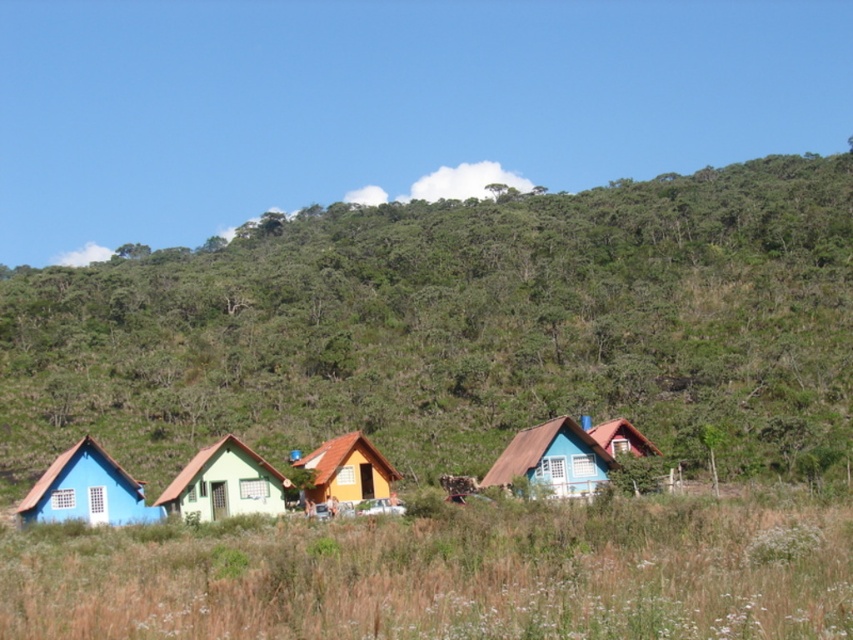
Question: Among these points, which one is farthest from the camera?

Choices:
 (A) (48, 516)
 (B) (345, 474)
 (C) (630, 440)
 (D) (514, 237)

Answer: (D)

Question: Which of these objects is positioned closest to the matte blue wooden hut at center?

Choices:
 (A) matte orange cabin at center
 (B) green matte house at center
 (C) matte blue wooden house at lower left

Answer: (A)

Question: Which of the following is the closest to the observer?

Choices:
 (A) green grass at lower center
 (B) blue matte house at center
 (C) matte blue wooden hut at center
 (D) green leafy hillside at center

Answer: (A)

Question: Does green grass at lower center appear on the left side of blue matte house at center?

Choices:
 (A) yes
 (B) no

Answer: (A)

Question: Can you confirm if green grass at lower center is positioned above matte blue wooden hut at center?

Choices:
 (A) yes
 (B) no

Answer: (A)

Question: Is green matte house at center above blue matte house at center?

Choices:
 (A) yes
 (B) no

Answer: (B)